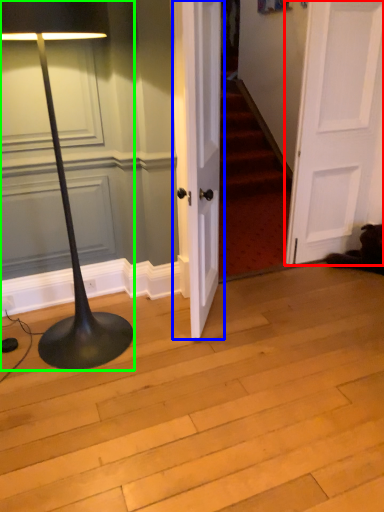
Question: Which object is the closest to the door (highlighted by a red box)? Choose among these: door (highlighted by a blue box) or lamp (highlighted by a green box).

Choices:
 (A) door
 (B) lamp

Answer: (A)